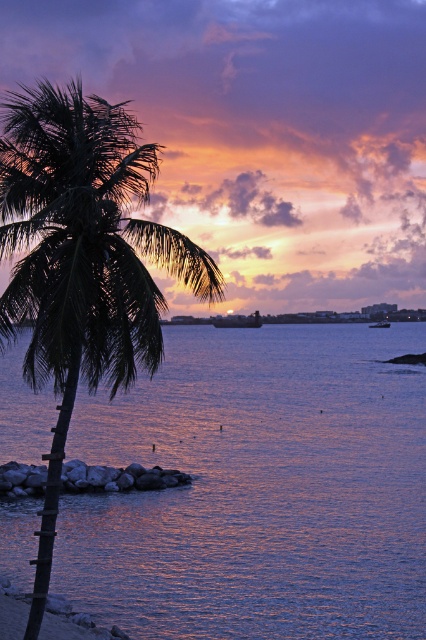
Question: Can you confirm if purple reflective water at center is smaller than metallic gray boat at center?

Choices:
 (A) no
 (B) yes

Answer: (A)

Question: Which of the following is the closest to the observer?

Choices:
 (A) (261, 320)
 (B) (247, 529)
 (C) (385, 320)

Answer: (B)

Question: Does purple reflective water at center have a smaller size compared to wooden boat at center?

Choices:
 (A) no
 (B) yes

Answer: (A)

Question: Which point is farther to the camera?

Choices:
 (A) metallic gray boat at center
 (B) purple reflective water at center
 (C) wooden boat at center
 (D) green leafy palm tree at left

Answer: (C)

Question: Does purple reflective water at center appear over metallic gray boat at center?

Choices:
 (A) yes
 (B) no

Answer: (B)

Question: Which point is farther from the camera taking this photo?

Choices:
 (A) (163, 230)
 (B) (143, 541)
 (C) (258, 326)

Answer: (C)